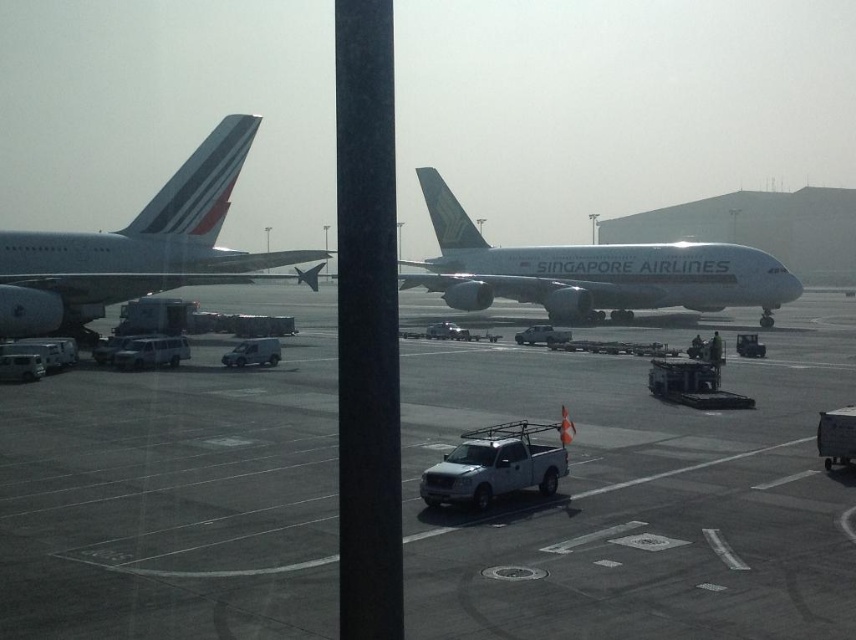
Is gray asphalt tarmac at center to the right of white glossy airplane at left from the viewer's perspective?

Yes, gray asphalt tarmac at center is to the right of white glossy airplane at left.

The height and width of the screenshot is (640, 856). What do you see at coordinates (638, 497) in the screenshot? I see `gray asphalt tarmac at center` at bounding box center [638, 497].

Is point (438, 550) farther from camera compared to point (218, 205)?

No, (438, 550) is closer to viewer.

Where is `gray asphalt tarmac at center`? gray asphalt tarmac at center is located at coordinates (638, 497).

Which is behind, point (467, 353) or point (752, 250)?

Point (752, 250)

This screenshot has height=640, width=856. Identify the location of gray asphalt tarmac at center. (638, 497).

Based on the photo, measure the distance between white glossy airplane at left and camera.

white glossy airplane at left is 25.27 meters away from camera.

How far apart are white glossy airplane at left and white glossy airplane at center?

A distance of 64.26 feet exists between white glossy airplane at left and white glossy airplane at center.

Between point (182, 236) and point (572, 307), which one is positioned behind?

The point (572, 307) is more distant.

Find the location of `white glossy airplane at left`. white glossy airplane at left is located at coordinates (135, 248).